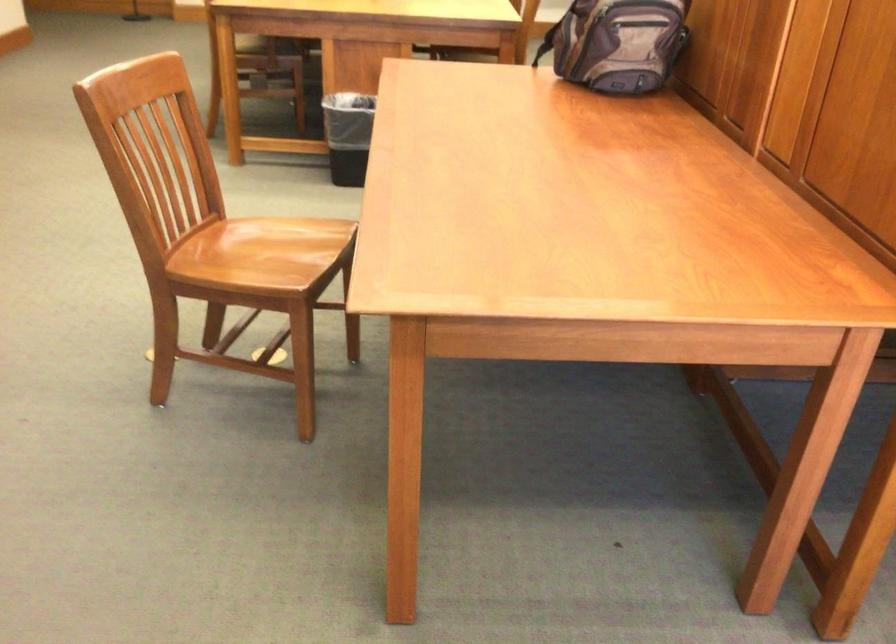
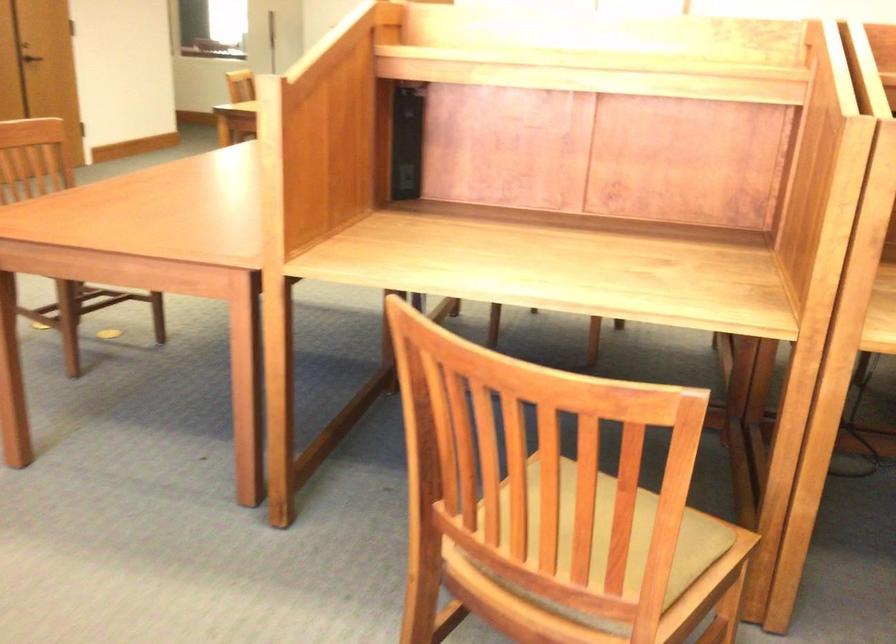
Question: What movement of the cameraman would produce the second image?

Choices:
 (A) Left
 (B) Right
 (C) Forward
 (D) Backward

Answer: (B)